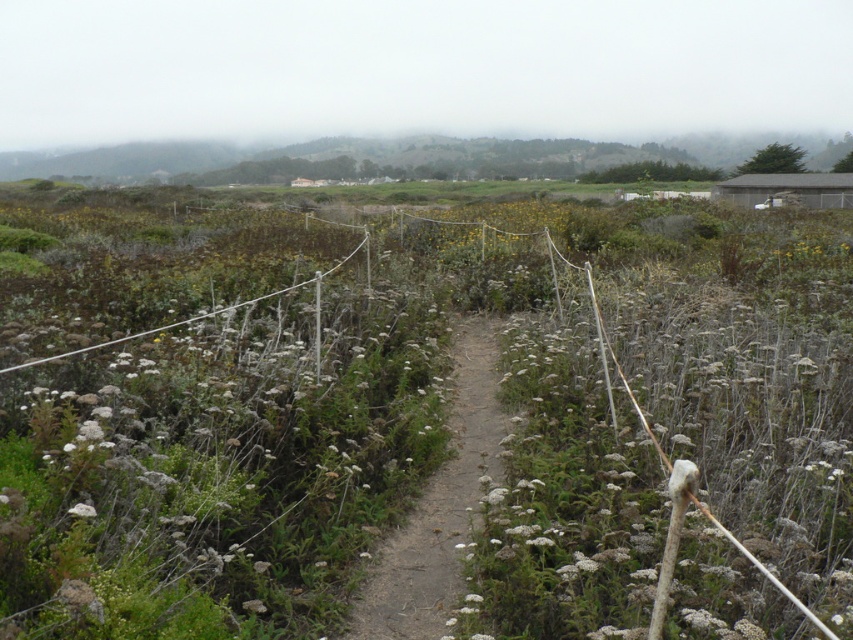
Question: Which object is the closest to the white fluffy flower at center?

Choices:
 (A) green matte plant at center
 (B) dirt path at center

Answer: (B)

Question: Is green matte plant at center thinner than dirt path at center?

Choices:
 (A) no
 (B) yes

Answer: (A)

Question: Which point is farther from the camera taking this photo?

Choices:
 (A) (404, 621)
 (B) (198, 269)
 (C) (74, 512)

Answer: (B)

Question: Is green matte plant at center to the left of white fluffy flower at center from the viewer's perspective?

Choices:
 (A) no
 (B) yes

Answer: (A)

Question: Estimate the real-world distances between objects in this image. Which object is farther from the green matte plant at center?

Choices:
 (A) dirt path at center
 (B) white fluffy flower at center

Answer: (B)

Question: Is dirt path at center further to the viewer compared to white fluffy flower at center?

Choices:
 (A) no
 (B) yes

Answer: (B)